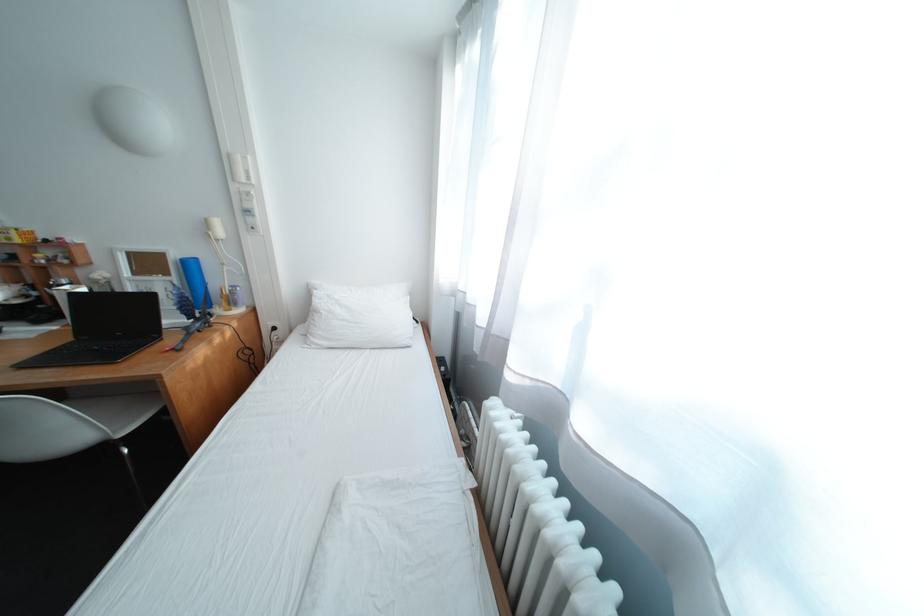
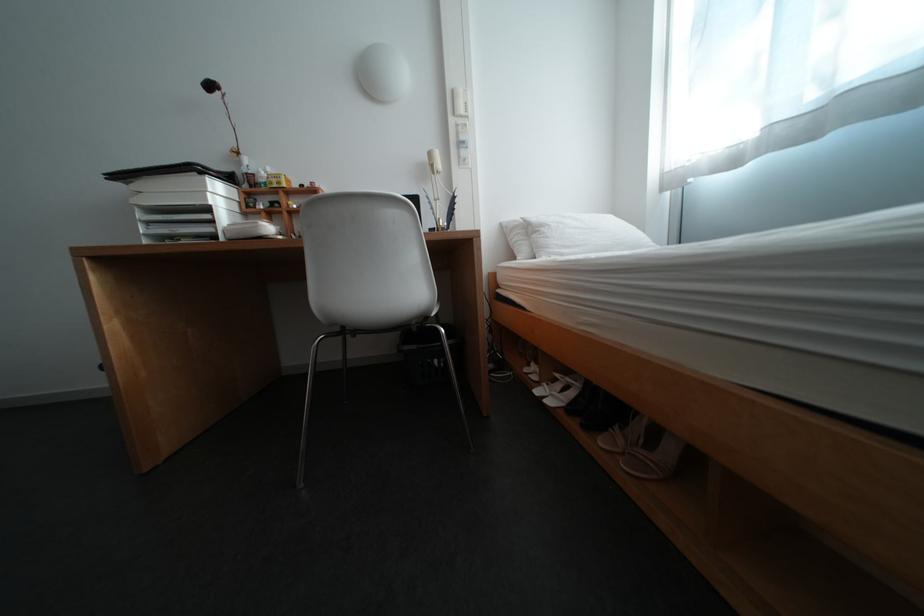
In the second image, find the point that corresponds to [330,314] in the first image.

(555, 228)